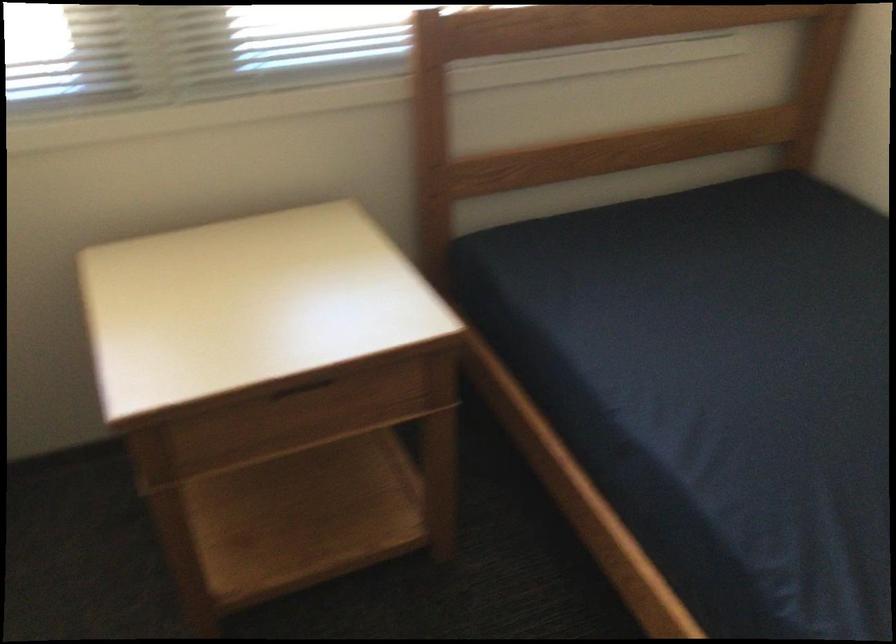
This screenshot has width=896, height=644. Describe the element at coordinates (304, 386) in the screenshot. I see `the wooden drawer handle` at that location.